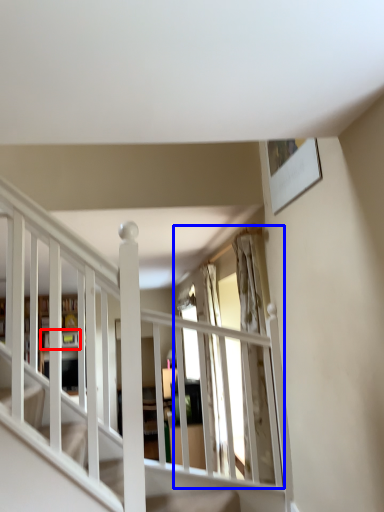
Question: Which object appears farthest to the camera in this image, shelf (highlighted by a red box) or window (highlighted by a blue box)?

Choices:
 (A) shelf
 (B) window

Answer: (A)